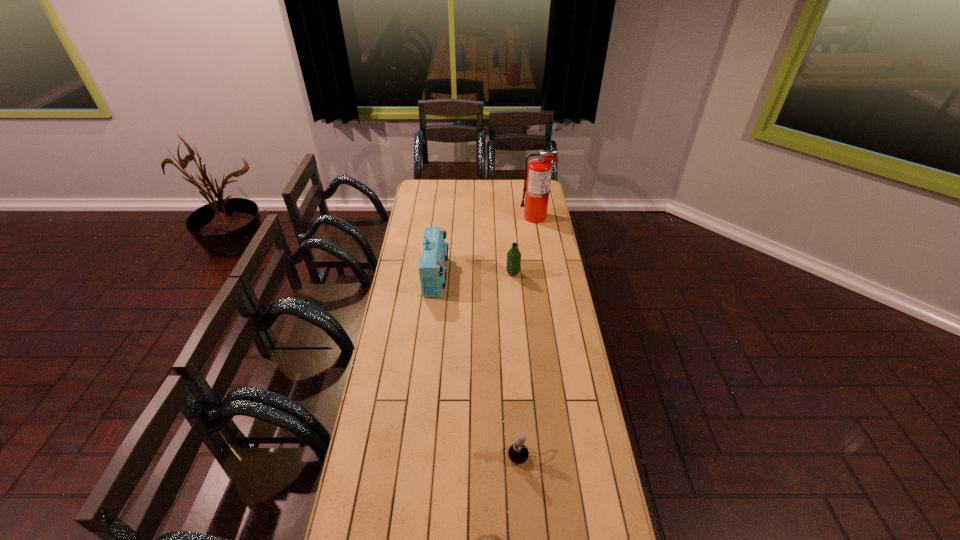
This screenshot has height=540, width=960. I want to click on the farthest object, so click(538, 173).

Identify the location of the tallest object. (538, 173).

This screenshot has width=960, height=540. I want to click on the fourth shortest object, so click(432, 270).

Locate an element on the screen. This screenshot has height=540, width=960. the third tallest object is located at coordinates (513, 255).

Find the location of `microphone`. microphone is located at coordinates (518, 453).

Where is `the second shortest object`? This screenshot has width=960, height=540. the second shortest object is located at coordinates (518, 453).

Locate an element on the screen. The height and width of the screenshot is (540, 960). vacant area situated 0.400m at the nozzle of the farthest object is located at coordinates (452, 217).

I want to click on free location located at the nozzle of the farthest object, so click(509, 217).

Image resolution: width=960 pixels, height=540 pixels. Find the location of `vacant area situated 0.270m at the nozzle of the farthest object`. vacant area situated 0.270m at the nozzle of the farthest object is located at coordinates (474, 217).

Where is `free spot located 0.250m on the front-facing side of the fourth shortest object`? The height and width of the screenshot is (540, 960). free spot located 0.250m on the front-facing side of the fourth shortest object is located at coordinates (497, 276).